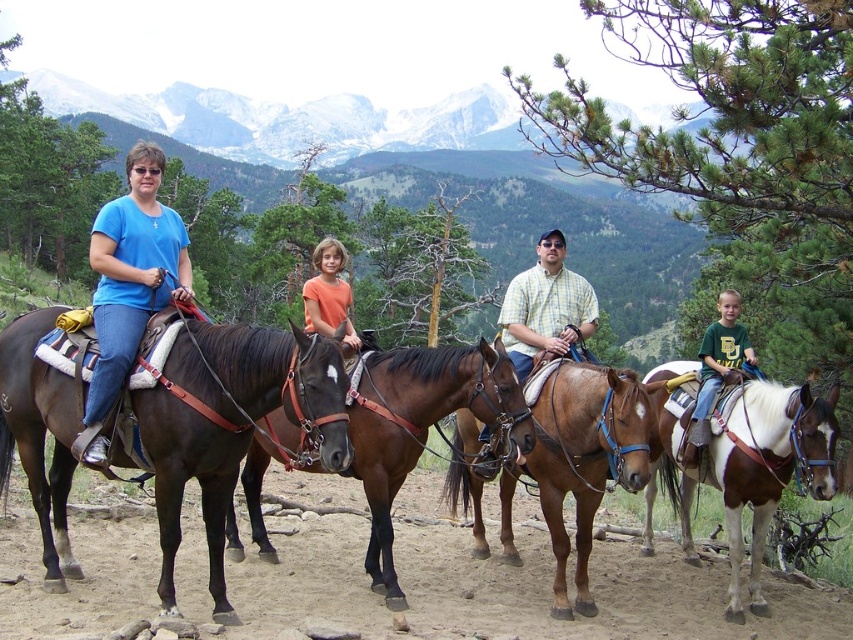
Question: Can you confirm if brown glossy horse at center is smaller than matte blue shirt at left?

Choices:
 (A) yes
 (B) no

Answer: (A)

Question: Can you confirm if brown leather horse at center is positioned below green cotton shirt at center?

Choices:
 (A) no
 (B) yes

Answer: (B)

Question: Estimate the real-world distances between objects in this image. Which object is farther from the white glossy horse at center?

Choices:
 (A) brown glossy horse at center
 (B) green cotton shirt at center

Answer: (A)

Question: Among these objects, which one is farthest from the camera?

Choices:
 (A) orange matte shirt at center
 (B) brown leather horse at center
 (C) brown glossy horse at center
 (D) green cotton shirt at center

Answer: (D)

Question: Which object is farther from the camera taking this photo?

Choices:
 (A) green cotton shirt at center
 (B) brown glossy horse at center

Answer: (A)

Question: Does white glossy horse at center have a lesser width compared to matte blue shirt at left?

Choices:
 (A) yes
 (B) no

Answer: (B)